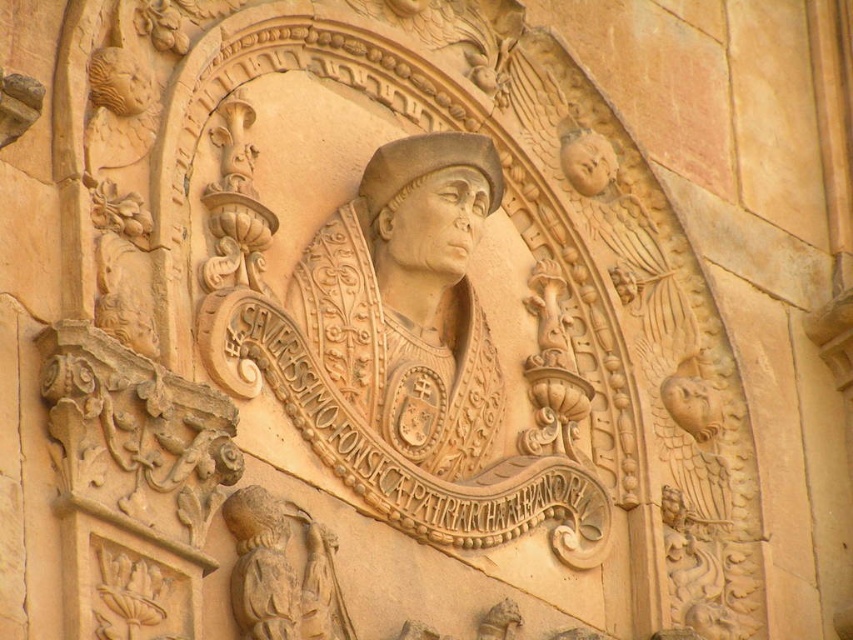
Does matte stone head at center have a greater height compared to beige stone head at lower left?

Yes.

Between point (474, 140) and point (273, 516), which one is positioned in front?

Point (273, 516) is in front.

Is point (364, 196) farther from viewer compared to point (273, 545)?

Yes, point (364, 196) is behind point (273, 545).

Find the location of a particular element. matte stone head at center is located at coordinates (425, 168).

Which is in front, point (263, 552) or point (596, 180)?

Point (263, 552) is more forward.

Where is `beige stone head at lower left`? This screenshot has width=853, height=640. beige stone head at lower left is located at coordinates (254, 520).

What do you see at coordinates (254, 520) in the screenshot? The height and width of the screenshot is (640, 853). I see `beige stone head at lower left` at bounding box center [254, 520].

Where is `beige stone head at lower left`? The width and height of the screenshot is (853, 640). beige stone head at lower left is located at coordinates (254, 520).

Can you confirm if matte stone head at center is positioned below matte stone head at upper right?

Yes.

Who is positioned more to the right, matte stone head at center or matte stone head at upper right?

matte stone head at upper right is more to the right.

What are the coordinates of `matte stone head at center` in the screenshot? It's located at (425, 168).